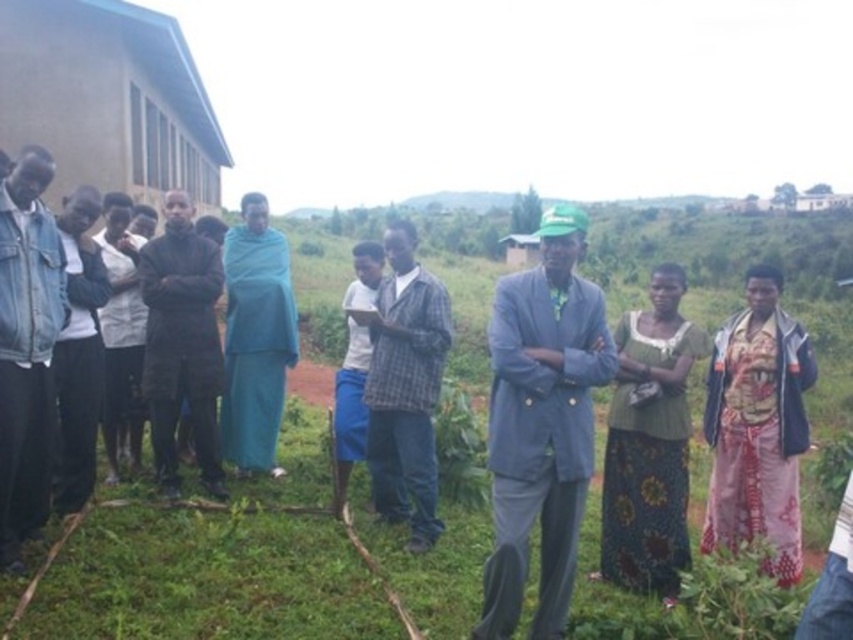
Does plaid fabric shirt at center appear on the right side of dark gray fabric jacket at left?

Indeed, plaid fabric shirt at center is positioned on the right side of dark gray fabric jacket at left.

Between plaid fabric shirt at center and dark gray fabric jacket at left, which one is positioned lower?

plaid fabric shirt at center is lower down.

Locate an element on the screen. The width and height of the screenshot is (853, 640). plaid fabric shirt at center is located at coordinates (405, 388).

Which of these two, denim jacket at left or dark gray fabric jacket at left, stands shorter?

dark gray fabric jacket at left is shorter.

What do you see at coordinates (26, 349) in the screenshot? I see `denim jacket at left` at bounding box center [26, 349].

Measure the distance between denim jacket at left and camera.

denim jacket at left is 4.13 meters away from camera.

Where is `denim jacket at left`? This screenshot has width=853, height=640. denim jacket at left is located at coordinates (26, 349).

Who is shorter, light gray suit at center or dark gray fabric jacket at left?

With less height is dark gray fabric jacket at left.

Identify the location of light gray suit at center. (541, 422).